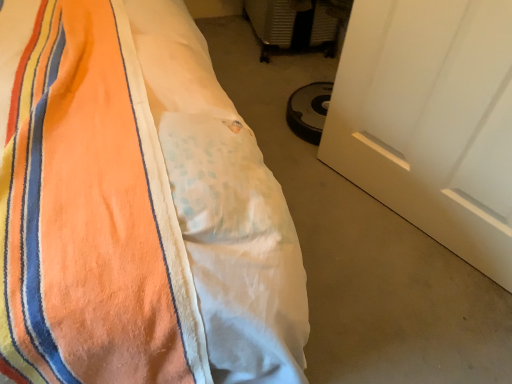
At what (x,y) coordinates should I click in order to perform the action: click on vacant space to the left of white matte door at lower right. Please return your answer as a coordinate pair (x, y). The width and height of the screenshot is (512, 384). Looking at the image, I should click on (316, 196).